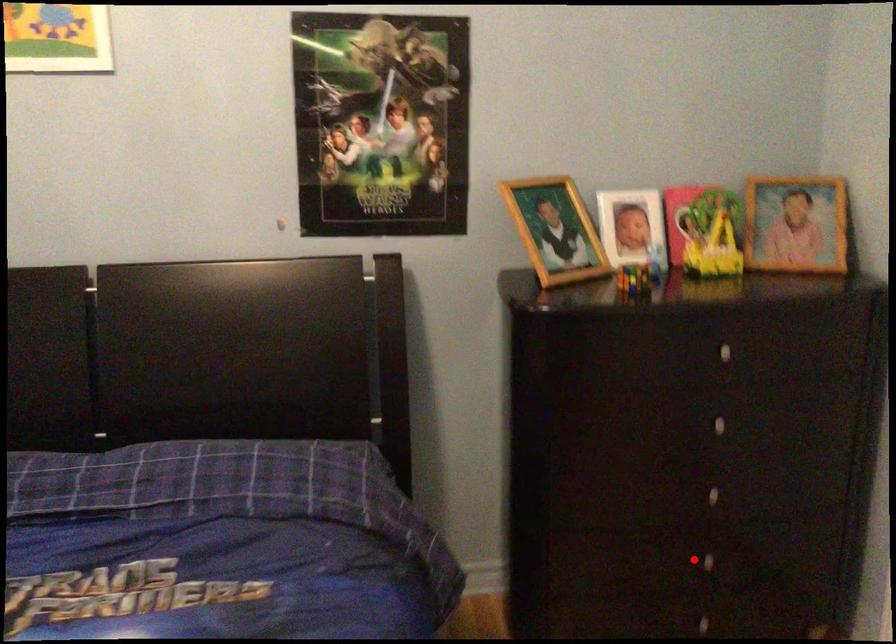
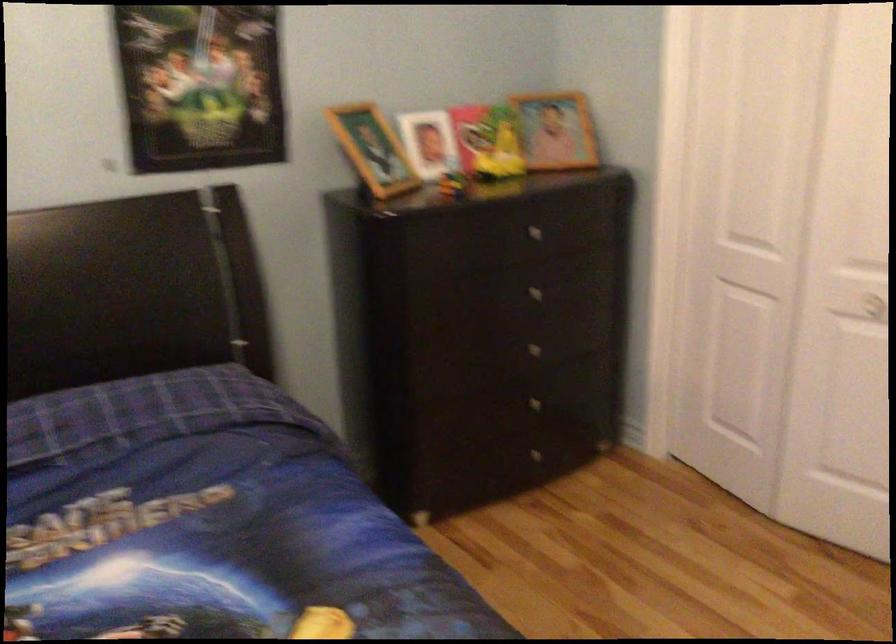
Question: I am providing you with two images of the same scene from different viewpoints. In image1, a red point is highlighted. Considering the same 3D point in image2, which of the following is correct?

Choices:
 (A) It is closer
 (B) It is farther

Answer: (B)